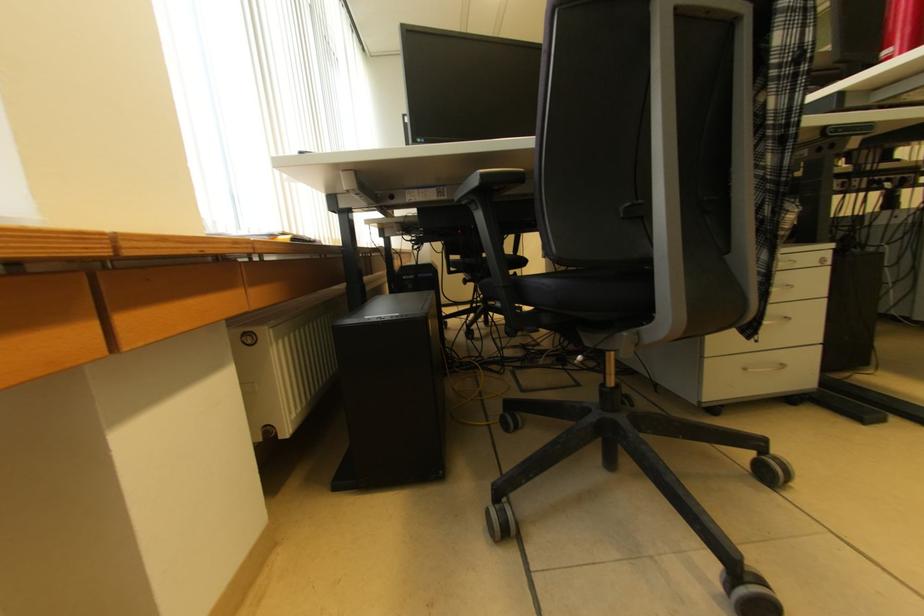
Where would you rest the chair armrest? Please return your answer as a coordinate pair (x, y).

(490, 180)